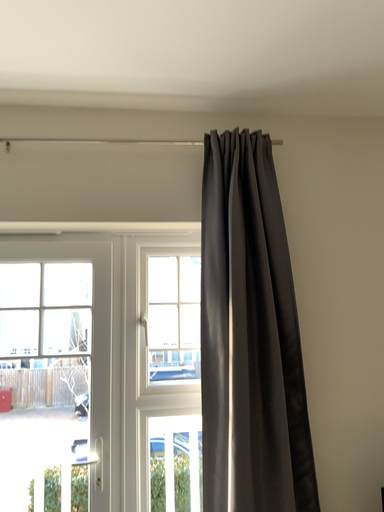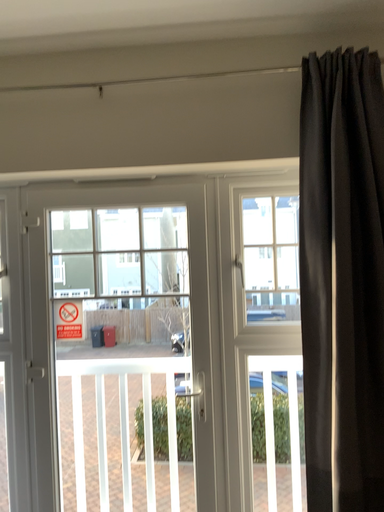
Question: How did the camera likely rotate when shooting the video?

Choices:
 (A) rotated left
 (B) rotated right

Answer: (A)